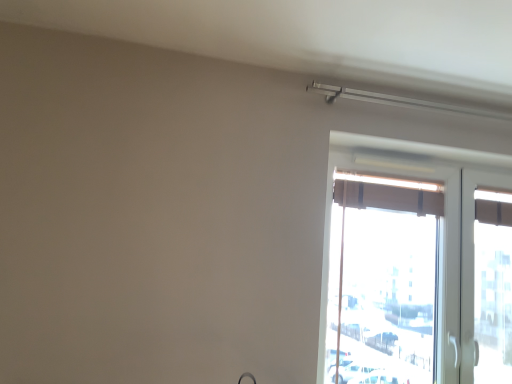
Question: In the image, is matte brown curtain at right positioned in front of or behind brown fabric curtain at upper right?

Choices:
 (A) behind
 (B) front

Answer: (B)

Question: In terms of height, does matte brown curtain at right look taller or shorter compared to brown fabric curtain at upper right?

Choices:
 (A) short
 (B) tall

Answer: (B)

Question: Considering the positions of point (432, 342) and point (382, 193), is point (432, 342) closer or farther from the camera than point (382, 193)?

Choices:
 (A) closer
 (B) farther

Answer: (A)

Question: Is point (390, 192) positioned closer to the camera than point (334, 175)?

Choices:
 (A) farther
 (B) closer

Answer: (A)

Question: Is brown fabric curtain at upper right in front of or behind matte brown curtain at right in the image?

Choices:
 (A) front
 (B) behind

Answer: (B)

Question: From the image's perspective, is brown fabric curtain at upper right positioned above or below matte brown curtain at right?

Choices:
 (A) above
 (B) below

Answer: (A)

Question: Is brown fabric curtain at upper right situated inside matte brown curtain at right or outside?

Choices:
 (A) inside
 (B) outside

Answer: (A)